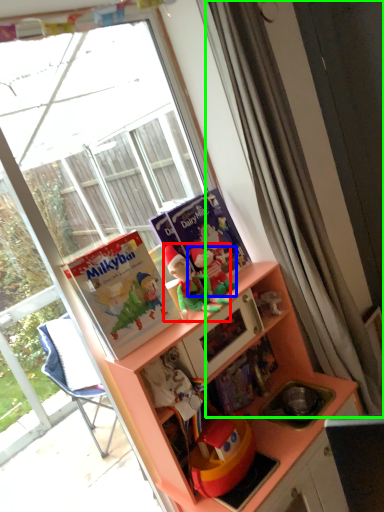
Question: Which is farther away from toy (highlighted by a red box)? toy (highlighted by a blue box) or curtain (highlighted by a green box)?

Choices:
 (A) toy
 (B) curtain

Answer: (B)